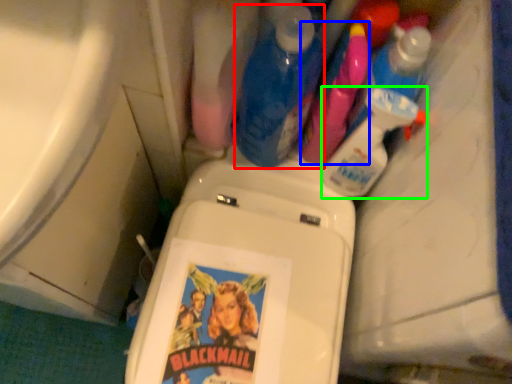
Question: Based on their relative distances, which object is nearer to cleaning product (highlighted by a red box)? Choose from cleaning product (highlighted by a blue box) and cleaning product (highlighted by a green box).

Choices:
 (A) cleaning product
 (B) cleaning product

Answer: (A)